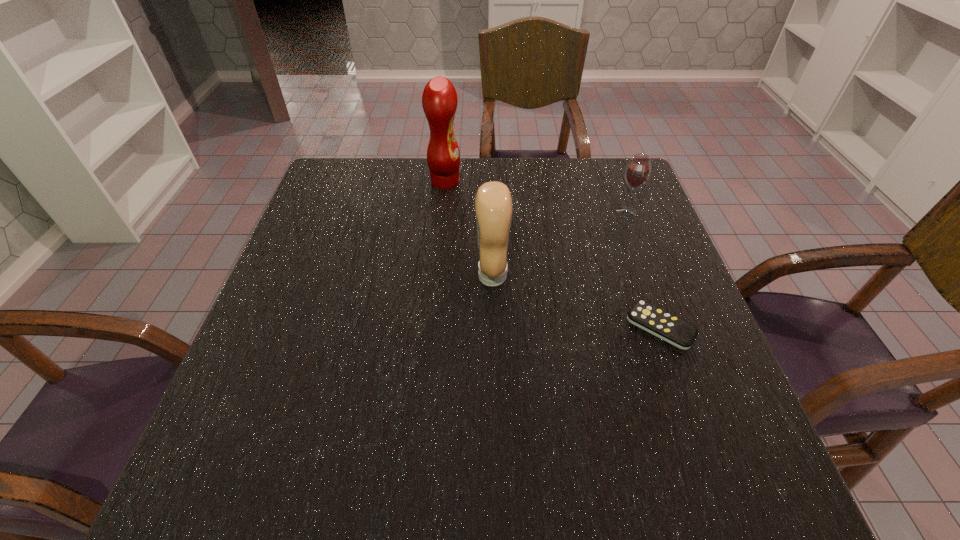
At what (x,y) coordinates should I click in order to perform the action: click on unoccupied area between the remote control and the third nearest object. Please return your answer as a coordinate pair (x, y). The image size is (960, 540). Looking at the image, I should click on (643, 269).

Locate an element on the screen. The image size is (960, 540). free space between the left condiment and the third nearest object is located at coordinates (536, 197).

Identify which object is the third closest to the nearest object. Please provide its 2D coordinates. Your answer should be formatted as a tuple, i.e. [(x, y)], where the tuple contains the x and y coordinates of a point satisfying the conditions above.

[(439, 100)]

The height and width of the screenshot is (540, 960). Identify the location of the third closest object to the second nearest object. (638, 170).

Locate an element on the screen. The image size is (960, 540). free point that satisfies the following two spatial constraints: 1. on the label side of the remote control; 2. on the right side of the farthest object is located at coordinates (431, 327).

Identify the location of free point that satisfies the following two spatial constraints: 1. on the label side of the taller condiment; 2. on the right side of the shortest object. (431, 327).

Locate an element on the screen. This screenshot has width=960, height=540. vacant region that satisfies the following two spatial constraints: 1. on the label side of the farther condiment; 2. on the right side of the third tallest object is located at coordinates 443,212.

The height and width of the screenshot is (540, 960). Identify the location of vacant area in the image that satisfies the following two spatial constraints: 1. on the label of the shorter condiment; 2. on the back side of the nearest object. (493, 327).

This screenshot has height=540, width=960. I want to click on vacant space that satisfies the following two spatial constraints: 1. on the label of the nearest object; 2. on the left side of the third farthest object, so click(x=493, y=327).

In order to click on blank area in the image that satisfies the following two spatial constraints: 1. on the label side of the farthest object; 2. on the right side of the remote control in this screenshot , I will do `click(431, 327)`.